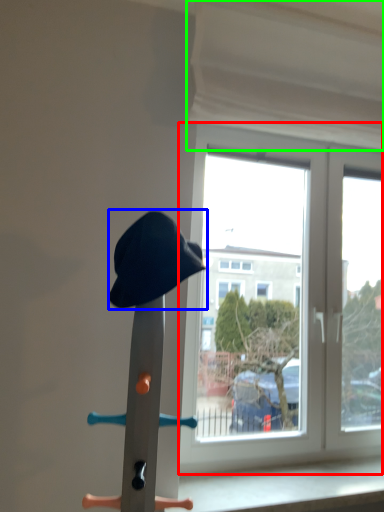
Question: Which is nearer to the window (highlighted by a red box)? hat (highlighted by a blue box) or curtain (highlighted by a green box).

Choices:
 (A) hat
 (B) curtain

Answer: (B)